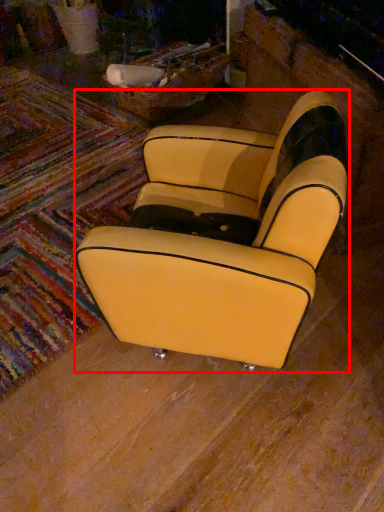
Question: From the image's perspective, where is chair (annotated by the red box) located relative to mat?

Choices:
 (A) above
 (B) below

Answer: (B)